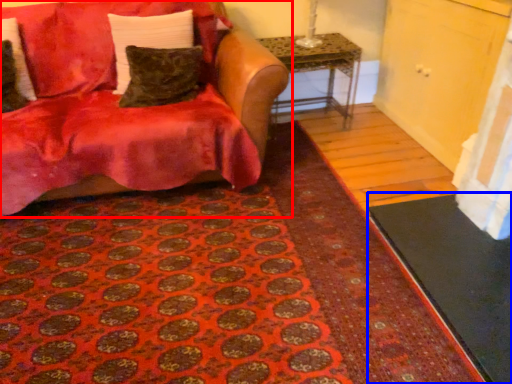
Question: Among these objects, which one is farthest to the camera, studio couch (highlighted by a red box) or doormat (highlighted by a blue box)?

Choices:
 (A) studio couch
 (B) doormat

Answer: (A)